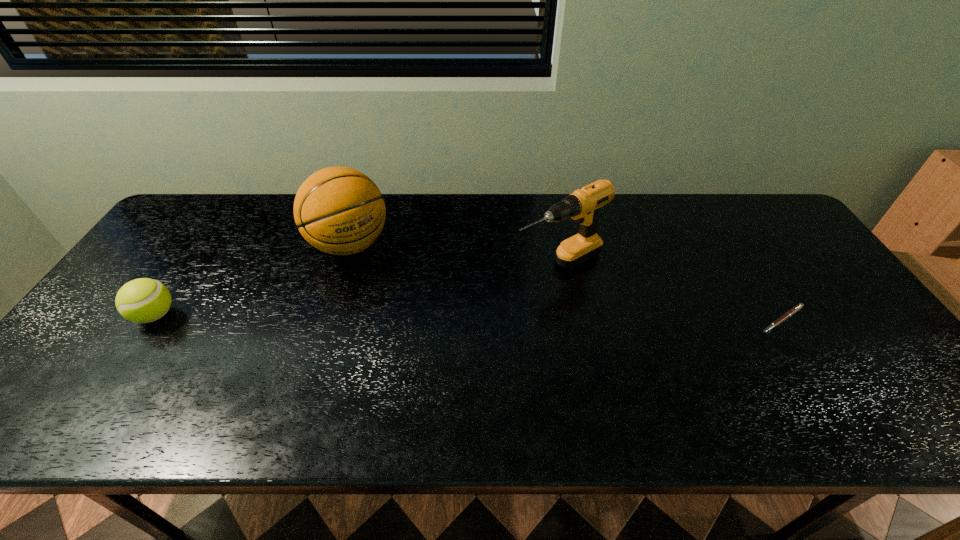
This screenshot has height=540, width=960. I want to click on free spot on the desktop that is between the third tallest object and the shortest object and is positioned on the surface of the basketball near the brand logo, so click(x=402, y=317).

The width and height of the screenshot is (960, 540). Find the location of `vacant space on the desktop that is between the leftmost object and the shortest object and is positioned at the tip of the third object from left to right`. vacant space on the desktop that is between the leftmost object and the shortest object and is positioned at the tip of the third object from left to right is located at coordinates (462, 318).